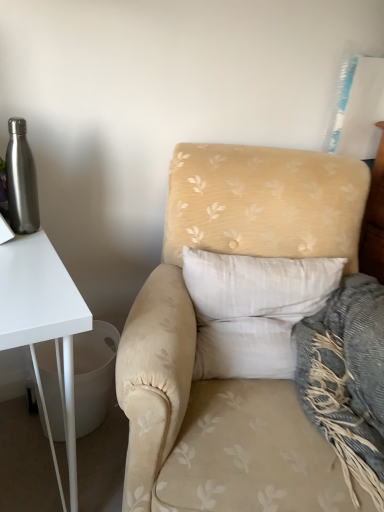
Question: Can you confirm if beige floral fabric armchair at center is shorter than white soft pillow at center?

Choices:
 (A) no
 (B) yes

Answer: (A)

Question: Can you confirm if beige floral fabric armchair at center is smaller than white soft pillow at center?

Choices:
 (A) no
 (B) yes

Answer: (A)

Question: Is white soft pillow at center a part of beige floral fabric armchair at center?

Choices:
 (A) yes
 (B) no

Answer: (A)

Question: Can you confirm if beige floral fabric armchair at center is bigger than white soft pillow at center?

Choices:
 (A) yes
 (B) no

Answer: (A)

Question: Considering the relative positions of beige floral fabric armchair at center and white soft pillow at center in the image provided, is beige floral fabric armchair at center behind white soft pillow at center?

Choices:
 (A) yes
 (B) no

Answer: (B)

Question: Considering the positions of white soft pillow at center and beige floral fabric armchair at center in the image, is white soft pillow at center taller or shorter than beige floral fabric armchair at center?

Choices:
 (A) tall
 (B) short

Answer: (B)

Question: Would you say white soft pillow at center is to the left or to the right of beige floral fabric armchair at center in the picture?

Choices:
 (A) right
 (B) left

Answer: (B)

Question: Is white soft pillow at center spatially inside beige floral fabric armchair at center, or outside of it?

Choices:
 (A) outside
 (B) inside

Answer: (B)

Question: Looking at their shapes, would you say white soft pillow at center is wider or thinner than beige floral fabric armchair at center?

Choices:
 (A) wide
 (B) thin

Answer: (B)

Question: Would you say beige floral fabric armchair at center is to the left or to the right of brushed metal water bottle at left in the picture?

Choices:
 (A) right
 (B) left

Answer: (A)

Question: Do you think beige floral fabric armchair at center is within brushed metal water bottle at left, or outside of it?

Choices:
 (A) inside
 (B) outside

Answer: (B)

Question: Looking at the image, does beige floral fabric armchair at center seem bigger or smaller compared to brushed metal water bottle at left?

Choices:
 (A) big
 (B) small

Answer: (A)

Question: Is point (246, 166) positioned closer to the camera than point (18, 135)?

Choices:
 (A) farther
 (B) closer

Answer: (A)

Question: Considering their positions, is beige floral fabric armchair at center located in front of or behind white soft pillow at center?

Choices:
 (A) front
 (B) behind

Answer: (A)

Question: Considering the relative positions of beige floral fabric armchair at center and white soft pillow at center in the image provided, is beige floral fabric armchair at center to the left or to the right of white soft pillow at center?

Choices:
 (A) left
 (B) right

Answer: (B)